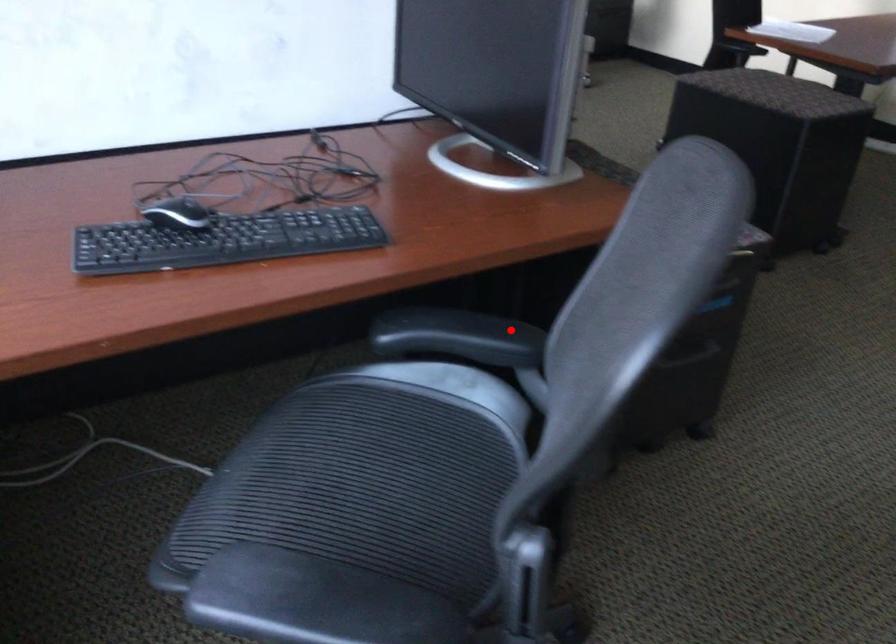
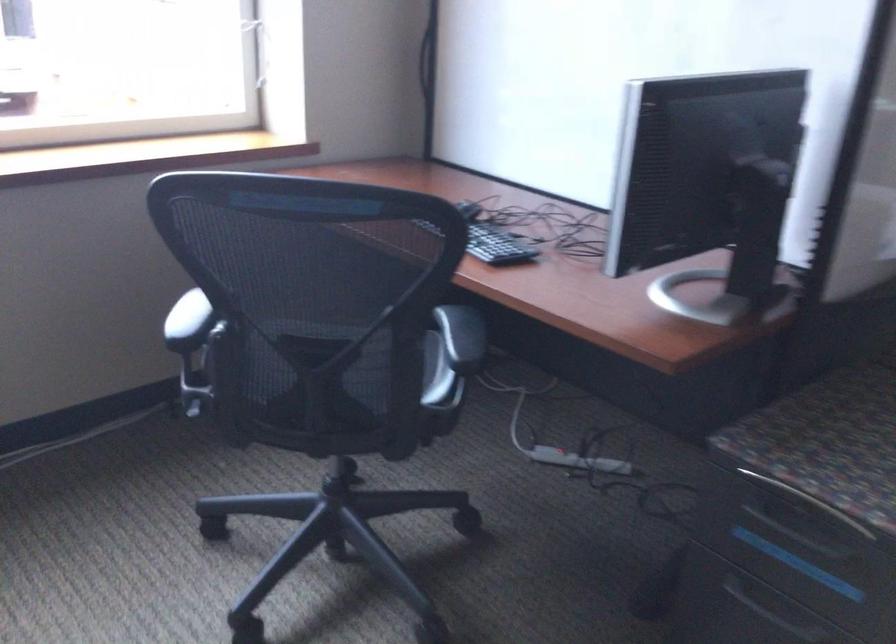
Where in the second image is the point corresponding to the highlighted location from the first image?

(461, 337)